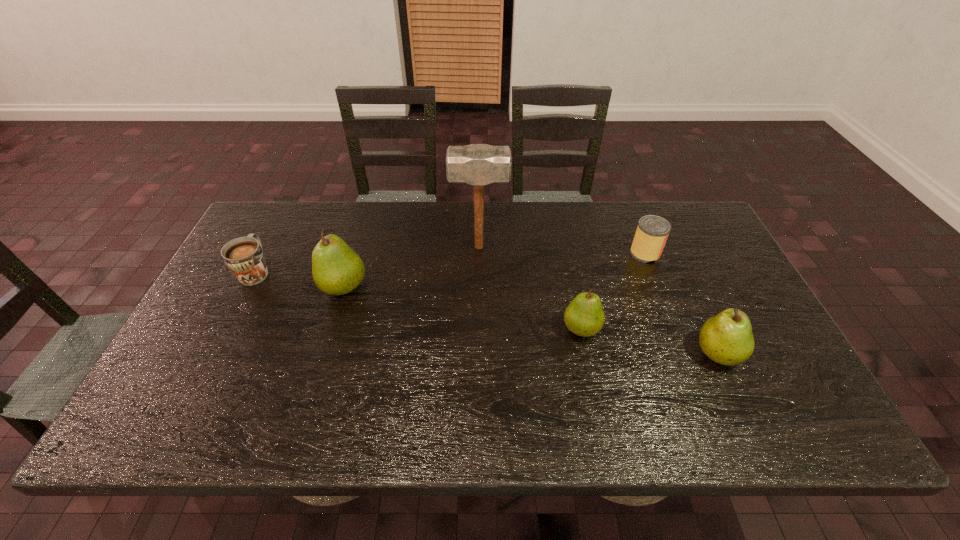
You are a GUI agent. You are given a task and a screenshot of the screen. Output one action in this format:
    pyautogui.click(x=<x>, y=<y>)
    Task: Click on the object that is at the near edge
    
    Given the screenshot: What is the action you would take?
    pyautogui.click(x=727, y=339)

The image size is (960, 540). What are the coordinates of `object that is at the left edge` in the screenshot? It's located at (244, 256).

Image resolution: width=960 pixels, height=540 pixels. Identify the location of object at the right edge. (727, 339).

Image resolution: width=960 pixels, height=540 pixels. Find the location of `object located at the near right corner`. object located at the near right corner is located at coordinates pos(727,339).

Find the location of a particular element. Image resolution: width=960 pixels, height=540 pixels. free space at the far edge of the desktop is located at coordinates (603, 228).

In the image, there is a desktop. Identify the location of vacant space at the near edge. The height and width of the screenshot is (540, 960). (530, 367).

You are a GUI agent. You are given a task and a screenshot of the screen. Output one action in this format:
    pyautogui.click(x=<x>, y=<y>)
    Task: Click on the free space at the left edge of the desktop
    The width and height of the screenshot is (960, 540).
    Given the screenshot: What is the action you would take?
    pyautogui.click(x=236, y=280)

Identify the location of vacant area at the far left corner of the desktop. (267, 224).

The image size is (960, 540). In order to click on free spot between the fifth object from right to left and the third tallest object in this screenshot , I will do `click(531, 320)`.

This screenshot has width=960, height=540. I want to click on blank region between the fifth object from right to left and the can, so [x=494, y=270].